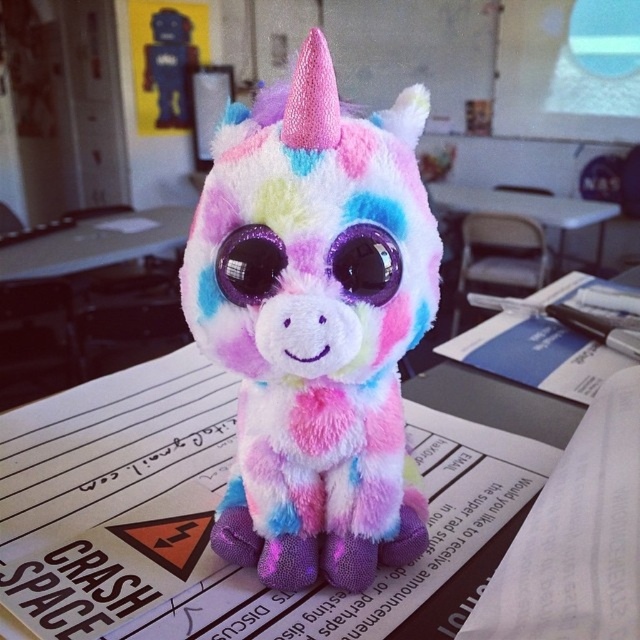
Question: Which is nearer to the shiny purple eyes at center?

Choices:
 (A) plush unicorn at center
 (B) white plastic table at center
 (C) fluffy rainbow unicorn at center

Answer: (C)

Question: Does fluffy rainbow unicorn at center appear on the right side of shiny purple eyes at center?

Choices:
 (A) yes
 (B) no

Answer: (A)

Question: Can you confirm if plush unicorn at center is smaller than shiny purple eyes at center?

Choices:
 (A) no
 (B) yes

Answer: (A)

Question: Does plush unicorn at center lie in front of white plastic table at center?

Choices:
 (A) yes
 (B) no

Answer: (A)

Question: Which point is farther to the camera?

Choices:
 (A) (344, 246)
 (B) (282, 620)
 (C) (582, 216)
 (D) (273, 291)

Answer: (C)

Question: Which is farther from the white plastic table at center?

Choices:
 (A) plush unicorn at center
 (B) shiny purple eyes at center
 (C) fluffy rainbow unicorn at center

Answer: (B)